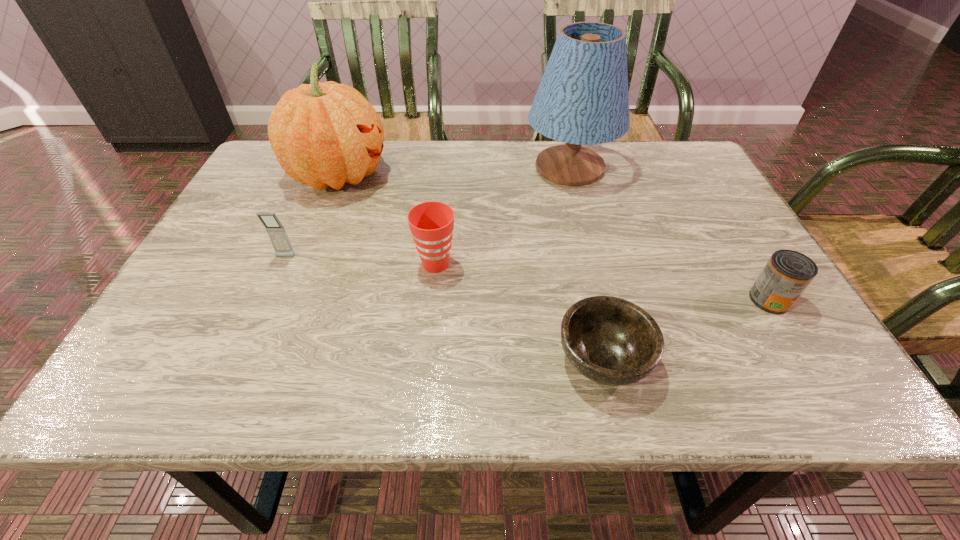
Identify the location of vacant space that is in between the shortest object and the lampshade. Image resolution: width=960 pixels, height=540 pixels. (587, 264).

Identify the location of free space between the cellular telephone and the shortest object. This screenshot has height=540, width=960. (444, 308).

Where is `unoccupied area between the cellular telephone and the second shortest object`? The width and height of the screenshot is (960, 540). unoccupied area between the cellular telephone and the second shortest object is located at coordinates (528, 278).

Identify which object is located as the third nearest to the cellular telephone. Please provide its 2D coordinates. Your answer should be formatted as a tuple, i.e. [(x, y)], where the tuple contains the x and y coordinates of a point satisfying the conditions above.

[(609, 340)]

The height and width of the screenshot is (540, 960). I want to click on object that stands as the third closest to the tallest object, so click(326, 134).

Locate an element on the screen. free region that satisfies the following two spatial constraints: 1. on the front-facing side of the cellular telephone; 2. on the left side of the fourth object from right to left is located at coordinates (282, 264).

The width and height of the screenshot is (960, 540). I want to click on vacant region that satisfies the following two spatial constraints: 1. on the front-facing side of the fifth farthest object; 2. on the left side of the cellular telephone, so click(266, 300).

You are a GUI agent. You are given a task and a screenshot of the screen. Output one action in this format:
    pyautogui.click(x=<x>, y=<y>)
    Task: Click on the free region that satisfies the following two spatial constraints: 1. on the front-facing side of the cellular telephone; 2. on the left side of the rightmost object
    
    Given the screenshot: What is the action you would take?
    pyautogui.click(x=266, y=300)

Image resolution: width=960 pixels, height=540 pixels. I want to click on vacant point that satisfies the following two spatial constraints: 1. on the front-facing side of the second nearest object; 2. on the left side of the cellular telephone, so click(x=266, y=300).